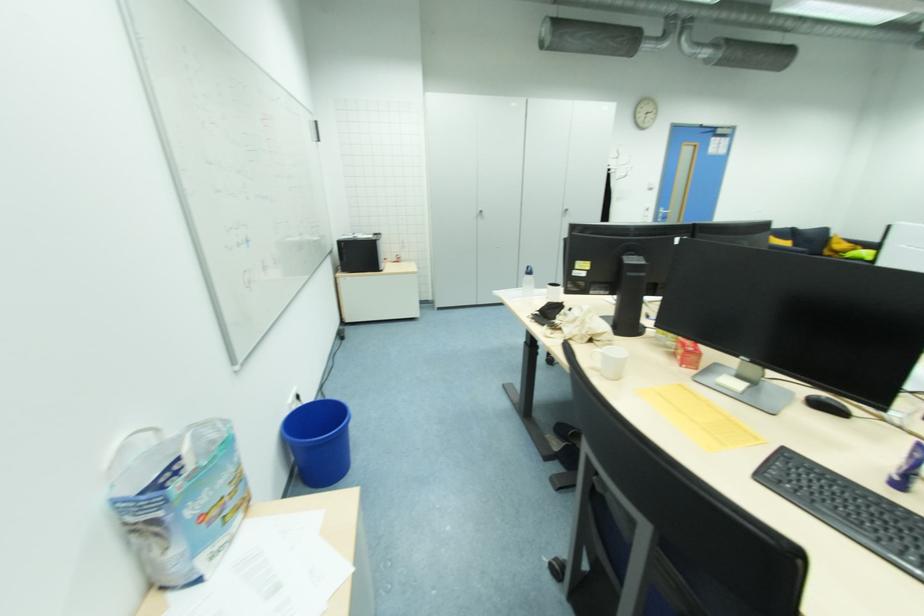
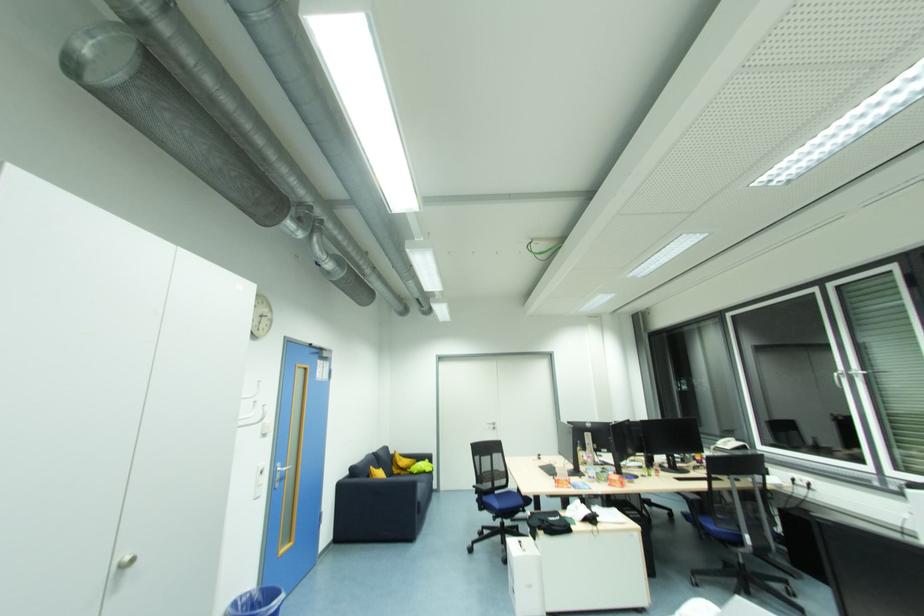
Locate, in the second image, the point that corresponds to the point at 828,254 in the first image.

(398, 472)